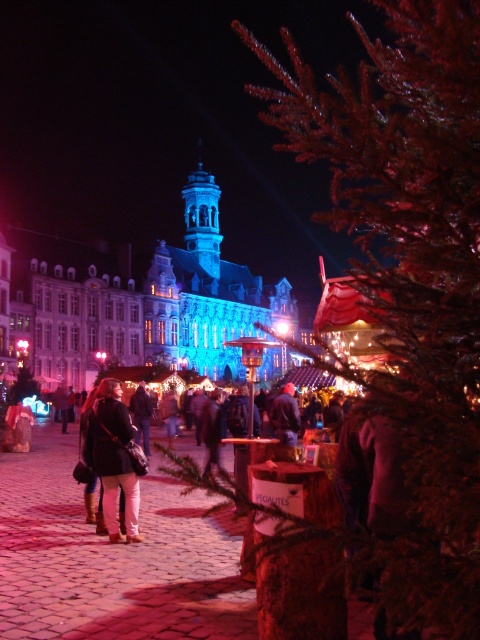
Question: Which of the following is the farthest from the observer?

Choices:
 (A) (287, 392)
 (B) (115, 484)
 (C) (462, 172)

Answer: (A)

Question: Is green textured pine tree at center closer to the viewer compared to matte black jacket at center?

Choices:
 (A) no
 (B) yes

Answer: (B)

Question: Considering the real-world distances, which object is closest to the dark blue jacket at center?

Choices:
 (A) matte black jacket at center
 (B) green textured pine tree at center

Answer: (A)

Question: Considering the relative positions of matte black jacket at center and dark blue jacket at center in the image provided, where is matte black jacket at center located with respect to dark blue jacket at center?

Choices:
 (A) below
 (B) above

Answer: (A)

Question: Does matte black jacket at center have a larger size compared to dark blue jacket at center?

Choices:
 (A) no
 (B) yes

Answer: (B)

Question: Among these points, which one is farthest from the camera?

Choices:
 (A) (127, 522)
 (B) (291, 426)

Answer: (B)